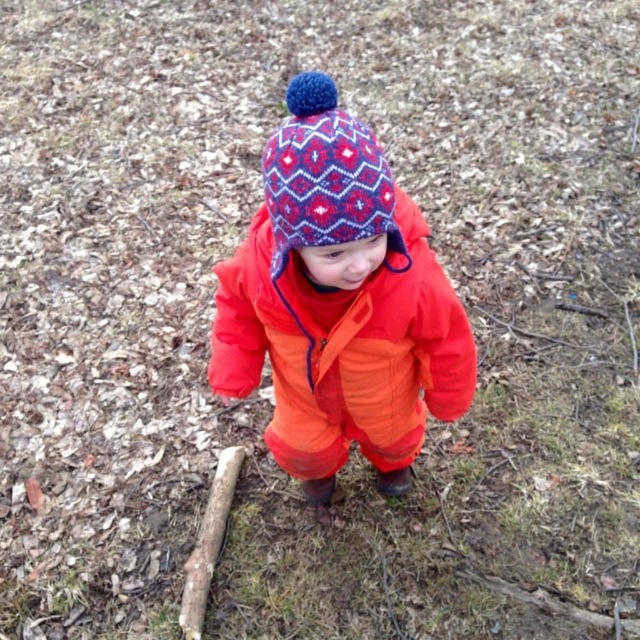
Question: Where is matte orange snowsuit at center located in relation to knitted woolen hat at center in the image?

Choices:
 (A) below
 (B) above

Answer: (A)

Question: Among these objects, which one is farthest from the camera?

Choices:
 (A) knitted woolen hat at center
 (B) matte orange snowsuit at center

Answer: (A)

Question: Does matte orange snowsuit at center have a greater width compared to knitted woolen hat at center?

Choices:
 (A) yes
 (B) no

Answer: (A)

Question: Is matte orange snowsuit at center further to the viewer compared to knitted woolen hat at center?

Choices:
 (A) no
 (B) yes

Answer: (A)